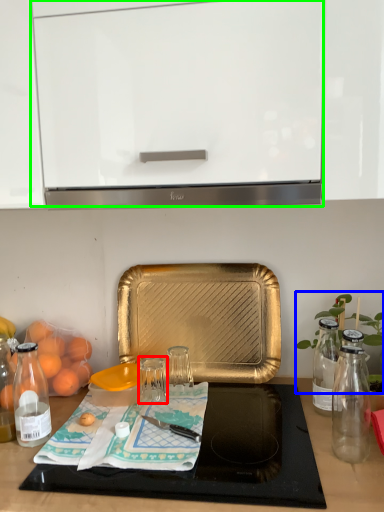
Question: Estimate the real-world distances between objects in this image. Which object is farther from glass jar (highlighted by a red box), plant (highlighted by a blue box) or cabinetry (highlighted by a green box)?

Choices:
 (A) plant
 (B) cabinetry

Answer: (B)